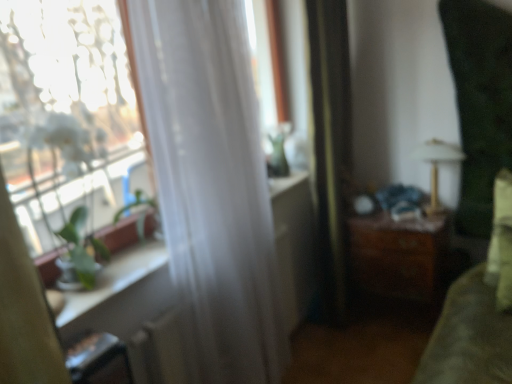
This screenshot has width=512, height=384. I want to click on vacant area situated below transparent glass window at left (from a real-world perspective), so click(105, 285).